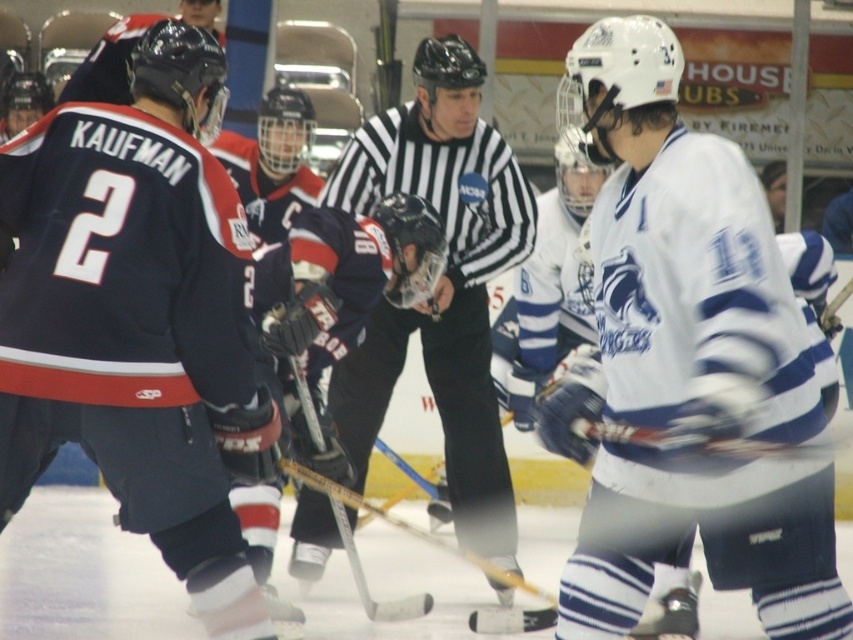
Does black and white striped shirt at center have a lesser width compared to wooden hockey stick at center?

No, black and white striped shirt at center is not thinner than wooden hockey stick at center.

Does black and white striped shirt at center lie behind wooden hockey stick at center?

Yes, it is.

Who is more distant from viewer, (302, 563) or (299, 392)?

Point (302, 563)

This screenshot has height=640, width=853. I want to click on black and white striped shirt at center, so click(440, 282).